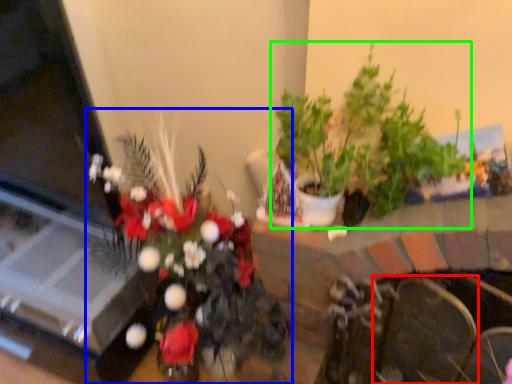
Question: Considering the real-world distances, which object is farthest from armchair (highlighted by a red box)? houseplant (highlighted by a blue box) or houseplant (highlighted by a green box)?

Choices:
 (A) houseplant
 (B) houseplant

Answer: (A)